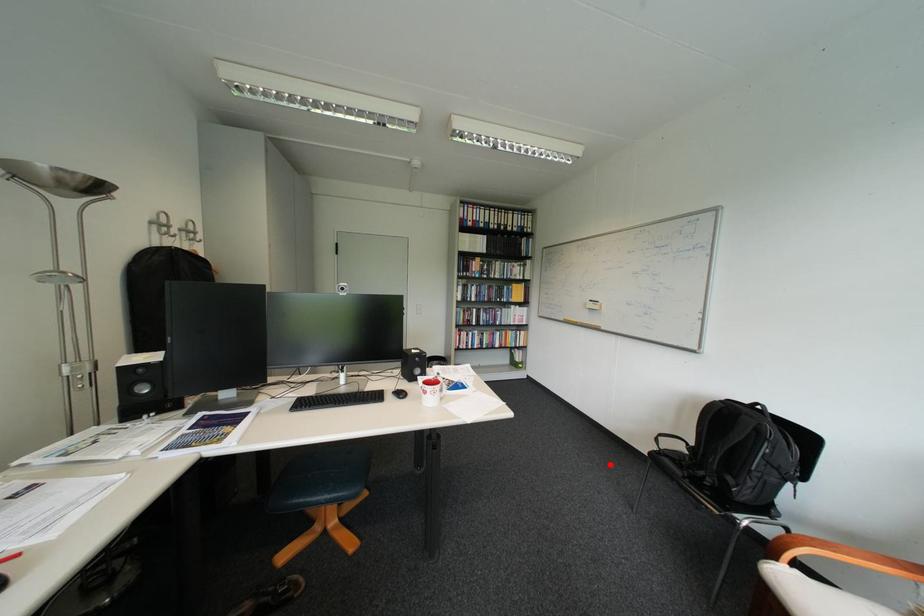
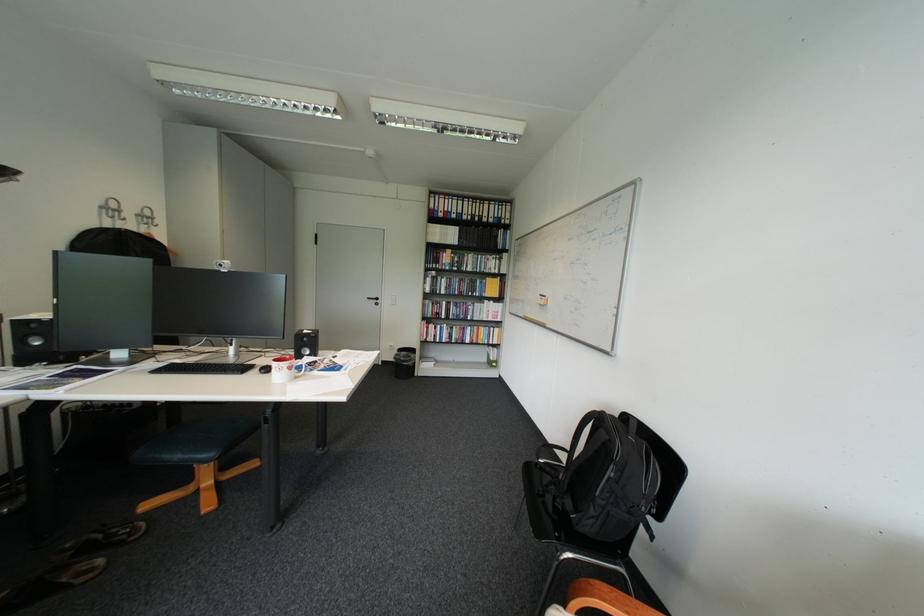
Question: A red point is marked in image1. In image2, is the corresponding 3D point closer to the camera or farther? Reply with the corresponding letter.

Choices:
 (A) The corresponding 3D point is closer.
 (B) The corresponding 3D point is farther.

Answer: (A)